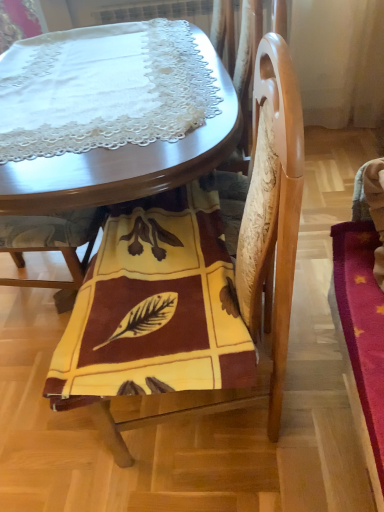
Question: Is yellow fabric chair at center, marked as the first chair in a left-to-right arrangement, oriented away from wooden table at center?

Choices:
 (A) no
 (B) yes

Answer: (B)

Question: Is yellow fabric chair at center, which appears as the second chair when viewed from the right, aimed at wooden table at center?

Choices:
 (A) no
 (B) yes

Answer: (B)

Question: Can you confirm if yellow fabric chair at center, which appears as the second chair when viewed from the right, is wider than wooden table at center?

Choices:
 (A) yes
 (B) no

Answer: (B)

Question: Would you consider yellow fabric chair at center, marked as the first chair in a left-to-right arrangement, to be distant from wooden table at center?

Choices:
 (A) no
 (B) yes

Answer: (A)

Question: Considering the relative sizes of yellow fabric chair at center, which appears as the second chair when viewed from the right, and wooden table at center in the image provided, is yellow fabric chair at center, which appears as the second chair when viewed from the right, bigger than wooden table at center?

Choices:
 (A) yes
 (B) no

Answer: (B)

Question: Is the depth of yellow fabric chair at center, which appears as the second chair when viewed from the right, greater than that of wooden table at center?

Choices:
 (A) no
 (B) yes

Answer: (A)

Question: Is yellow woolen blanket at center, which is the 2th chair from left to right, closer to camera compared to wooden table at center?

Choices:
 (A) no
 (B) yes

Answer: (B)

Question: Is yellow woolen blanket at center, which is the 2th chair from left to right, in contact with wooden table at center?

Choices:
 (A) no
 (B) yes

Answer: (A)

Question: Does yellow woolen blanket at center, which is the 2th chair from left to right, have a lesser height compared to wooden table at center?

Choices:
 (A) no
 (B) yes

Answer: (A)

Question: Is wooden table at center inside yellow woolen blanket at center, which is the 2th chair from left to right?

Choices:
 (A) yes
 (B) no

Answer: (B)

Question: Does yellow woolen blanket at center, which is the 2th chair from left to right, have a lesser width compared to wooden table at center?

Choices:
 (A) no
 (B) yes

Answer: (B)

Question: Can you confirm if yellow woolen blanket at center, which is the 2th chair from left to right, is smaller than wooden table at center?

Choices:
 (A) yes
 (B) no

Answer: (A)

Question: Considering the relative sizes of yellow fabric chair at center, marked as the first chair in a left-to-right arrangement, and yellow fabric at lower center in the image provided, is yellow fabric chair at center, marked as the first chair in a left-to-right arrangement, shorter than yellow fabric at lower center?

Choices:
 (A) yes
 (B) no

Answer: (B)